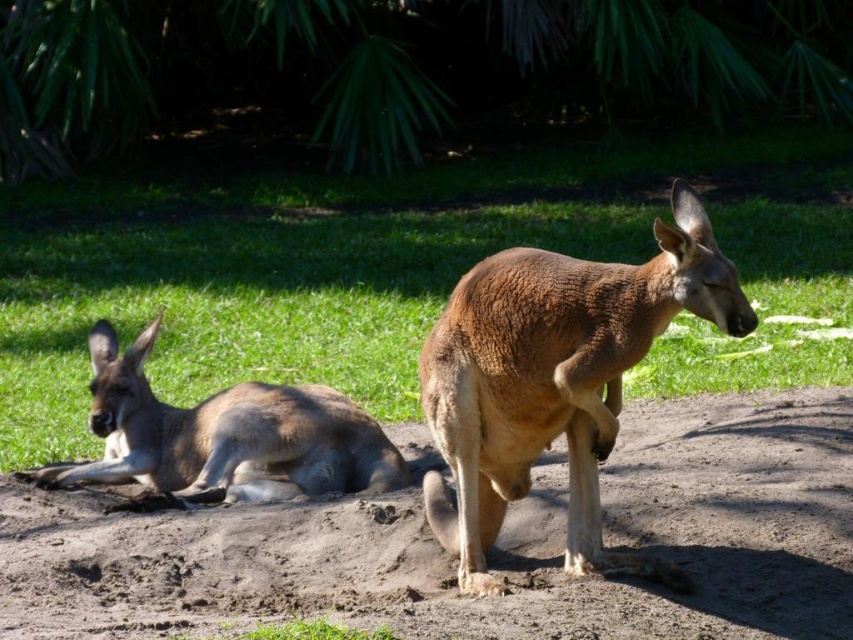
Between green grass at center and brown fur kangaroo at center, which one has less height?

brown fur kangaroo at center

Looking at this image, is green grass at center above brown fur kangaroo at center?

Indeed, green grass at center is positioned over brown fur kangaroo at center.

Between point (763, 308) and point (544, 406), which one is positioned behind?

Positioned behind is point (763, 308).

Image resolution: width=853 pixels, height=640 pixels. What are the coordinates of `green grass at center` in the screenshot? It's located at (401, 273).

Consider the image. Does green grass at center lie in front of brown sandy dirt at center?

No, green grass at center is further to the viewer.

Who is taller, green grass at center or brown sandy dirt at center?

With more height is green grass at center.

Where is `green grass at center`? green grass at center is located at coordinates (401, 273).

Between brown fur kangaroo at center and brown fur kangaroo at lower left, which one is positioned higher?

brown fur kangaroo at center is higher up.

Locate an element on the screen. This screenshot has width=853, height=640. brown fur kangaroo at center is located at coordinates coord(555,380).

Which is behind, point (462, 458) or point (256, 464)?

The point (256, 464) is more distant.

At what (x,y) coordinates should I click in order to perform the action: click on brown fur kangaroo at center. Please return your answer as a coordinate pair (x, y). This screenshot has height=640, width=853. Looking at the image, I should click on pos(555,380).